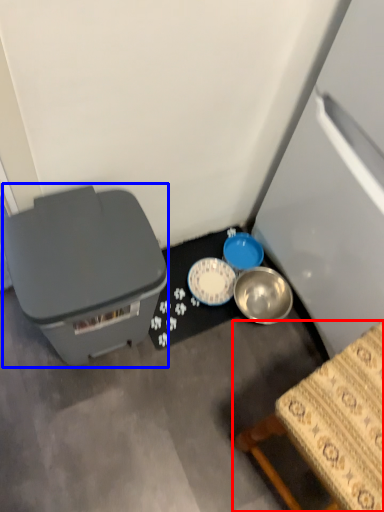
Question: Which point is further to the camera, furniture (highlighted by a red box) or storage box (highlighted by a blue box)?

Choices:
 (A) furniture
 (B) storage box

Answer: (B)